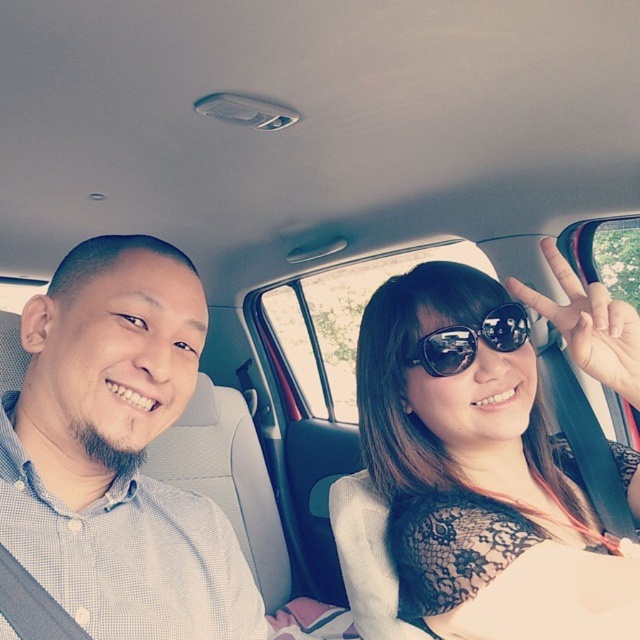
Can you confirm if sunglasseslace fabric at center is shorter than white checkered shirt at left?

Correct, sunglasseslace fabric at center is not as tall as white checkered shirt at left.

This screenshot has height=640, width=640. Find the location of `sunglasseslace fabric at center`. sunglasseslace fabric at center is located at coordinates (477, 474).

This screenshot has height=640, width=640. I want to click on sunglasseslace fabric at center, so click(477, 474).

Who is taller, sunglasseslace fabric at center or sunglasses at center?

With more height is sunglasseslace fabric at center.

The image size is (640, 640). Describe the element at coordinates (477, 474) in the screenshot. I see `sunglasseslace fabric at center` at that location.

Is point (458, 296) positioned behind point (422, 342)?

Yes, point (458, 296) is behind point (422, 342).

Locate an element on the screen. sunglasseslace fabric at center is located at coordinates 477,474.

Is white checkered shirt at left smaller than sunglasses at center?

Incorrect, white checkered shirt at left is not smaller in size than sunglasses at center.

Is white checkered shirt at left positioned at the back of sunglasses at center?

No, it is in front of sunglasses at center.

Where is `white checkered shirt at left`? Image resolution: width=640 pixels, height=640 pixels. white checkered shirt at left is located at coordinates (116, 452).

The image size is (640, 640). I want to click on white checkered shirt at left, so click(x=116, y=452).